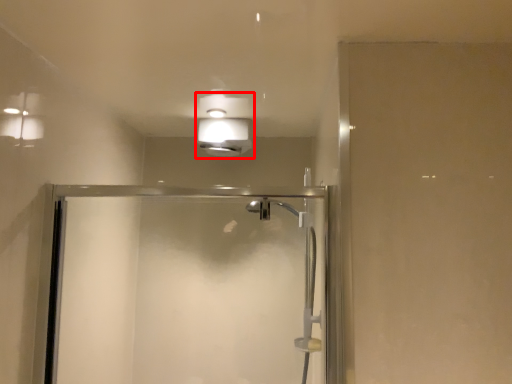
Question: From the image's perspective, considering the relative positions of light fixture (annotated by the red box) and screen door in the image provided, where is light fixture (annotated by the red box) located with respect to the staircase?

Choices:
 (A) above
 (B) below

Answer: (A)